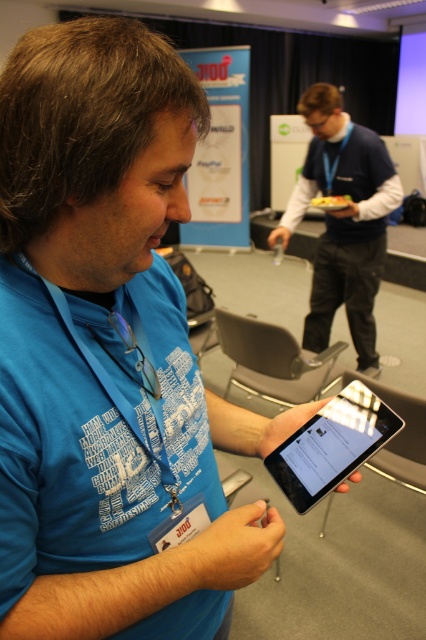
Question: Does blue fabric shirt at center have a larger size compared to black glossy tablet at center?

Choices:
 (A) yes
 (B) no

Answer: (A)

Question: Among these points, which one is farthest from the camera?

Choices:
 (A) (279, 230)
 (B) (348, 445)

Answer: (A)

Question: Is blue fabric shirt at center thinner than black glossy tablet at center?

Choices:
 (A) yes
 (B) no

Answer: (B)

Question: Is the position of blue fabric shirt at center more distant than that of black glossy tablet at center?

Choices:
 (A) yes
 (B) no

Answer: (A)